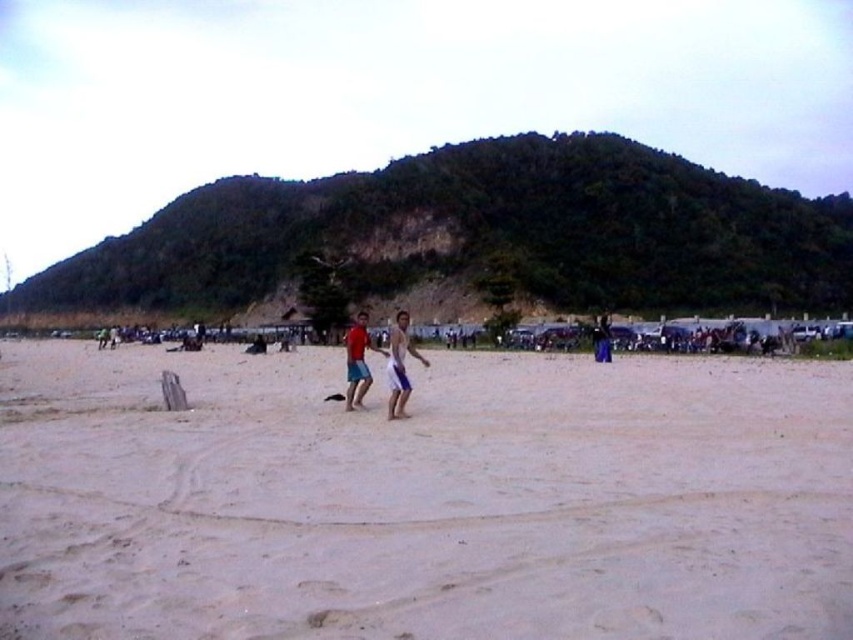
You are standing at the beach and want to walk to the point marked as point (x=402, y=385). However, there is an obstacle at point (x=357, y=403). Can you safely walk around the obstacle to reach your destination?

Yes, you can safely walk around the obstacle because point (x=402, y=385) is in front of point (x=357, y=403), meaning the destination is closer to you than the obstacle, allowing you to navigate around it.

You are a photographer trying to capture a photo of the light beige sand at center and the light blue shorts at center. From your current position, which object is closer to you?

The light beige sand at center is closer to you because it is positioned in front of the light blue shorts at center.

You are a drone operator trying to capture a photo of the beach scene. The camera is currently focused on the two individuals in the center. To include the light beige sand at center in the shot, should you adjust the camera upwards or downwards?

The light beige sand at center is located at point (422,499) in the image. Since the camera is focused on the two individuals in the center, adjusting it downwards would move the focus towards the lower part of the image where the light beige sand at center is situated.